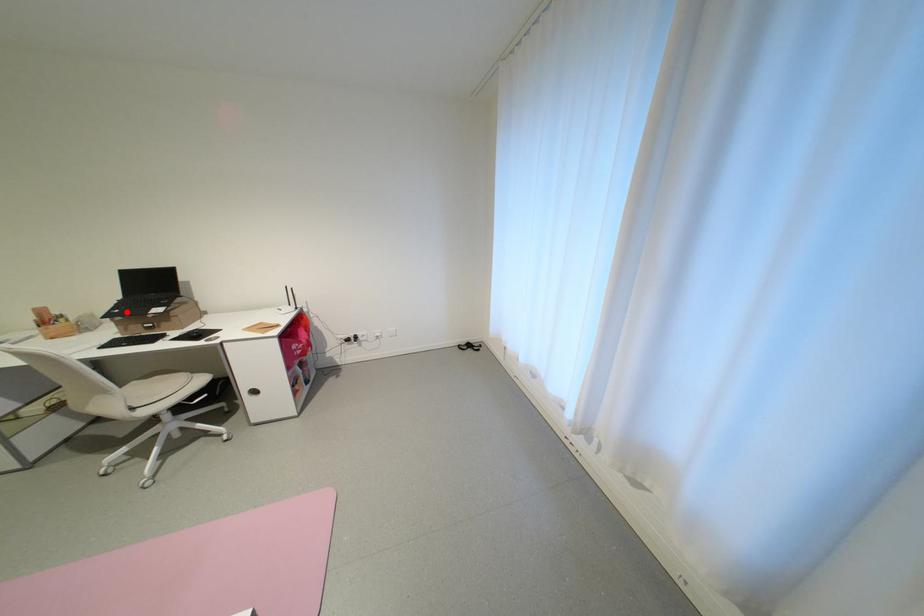
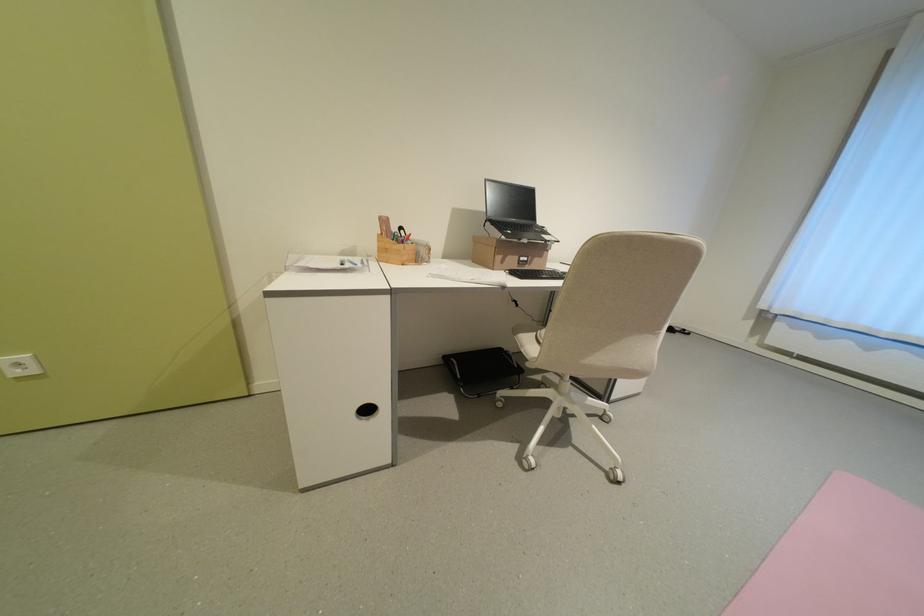
The point at the highlighted location is marked in the first image. Where is the corresponding point in the second image?

(518, 233)